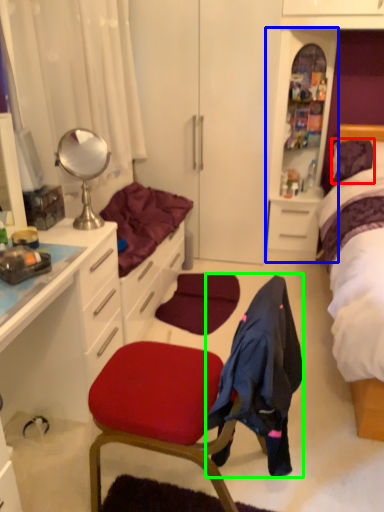
Question: Estimate the real-world distances between objects in this image. Which object is farther from pillow (highlighted by a red box), file cabinet (highlighted by a blue box) or clothing (highlighted by a green box)?

Choices:
 (A) file cabinet
 (B) clothing

Answer: (B)